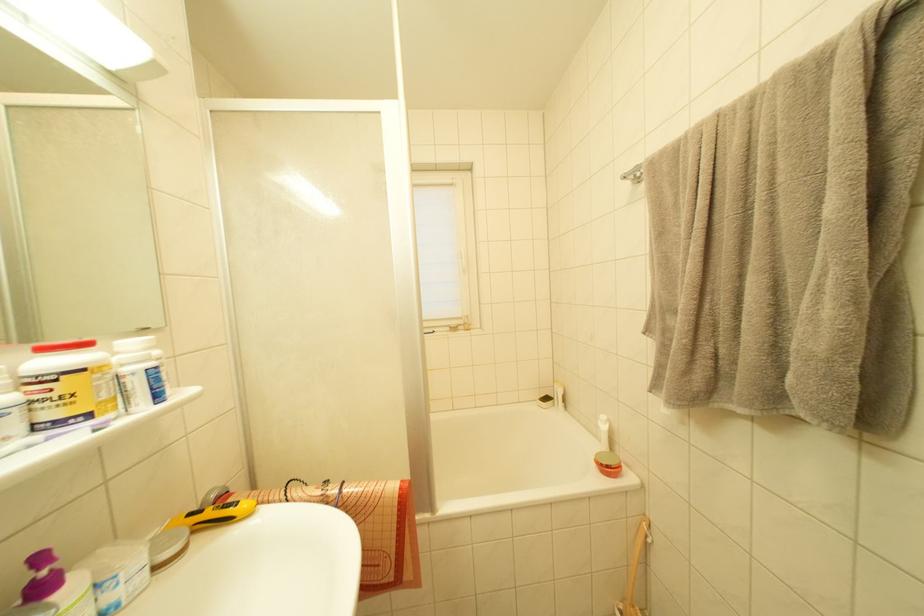
At what (x,y) coordinates should I click in order to perform the action: click on shower door frame. Please return your answer as a coordinate pair (x, y). Image resolution: width=924 pixels, height=616 pixels. Looking at the image, I should click on (417, 363).